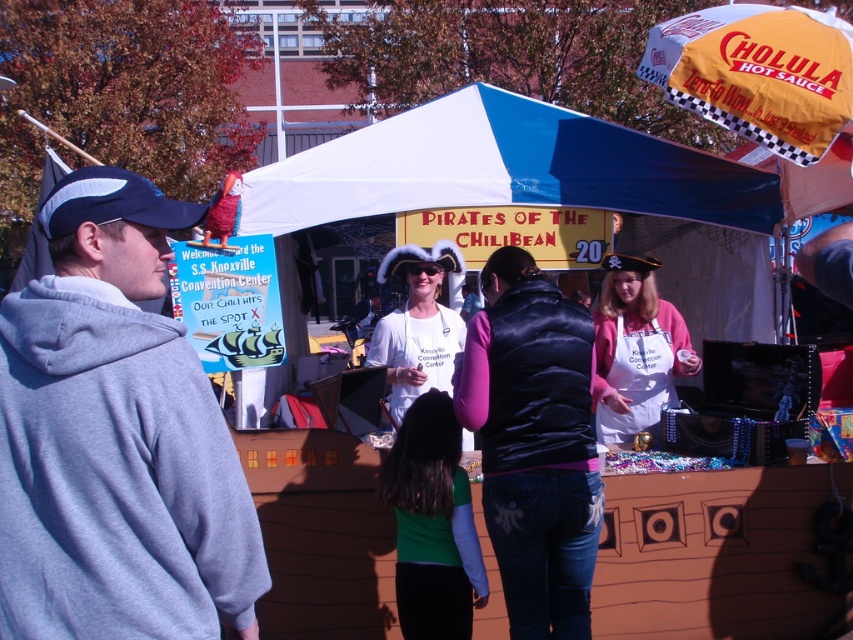
You are organizing a costume party and need to decide which item to place first. The gray fleece hoodie at left is smaller than the blue fabric canopy at upper center. Which item should you place first if you want to start with the larger item?

You should place the blue fabric canopy at upper center first because it is larger than the gray fleece hoodie at left.

You are a vendor at the pirate booth and need to place a gray fleece hoodie at left and a yellow fabric umbrella at upper right on a shelf. Which item requires a wider space on the shelf?

The yellow fabric umbrella at upper right requires a wider space on the shelf because it has a greater width compared to the gray fleece hoodie at left.

You are organizing a pirate party and need to decide which item to place on a small shelf. The gray fleece hoodie at left is smaller than the yellow fabric umbrella at upper right. Which item would fit better on the shelf?

The gray fleece hoodie at left occupies less space than the yellow fabric umbrella at upper right, so it would fit better on the small shelf.